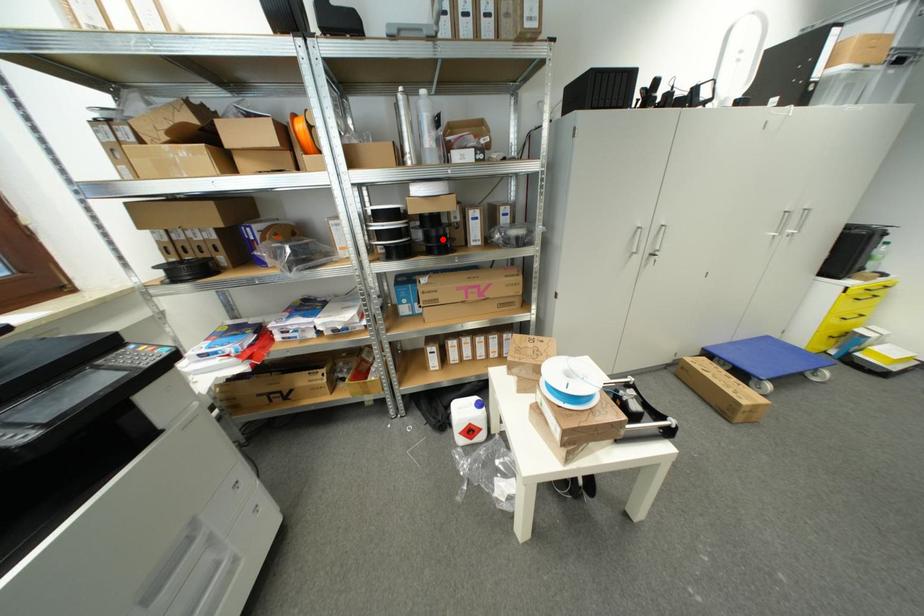
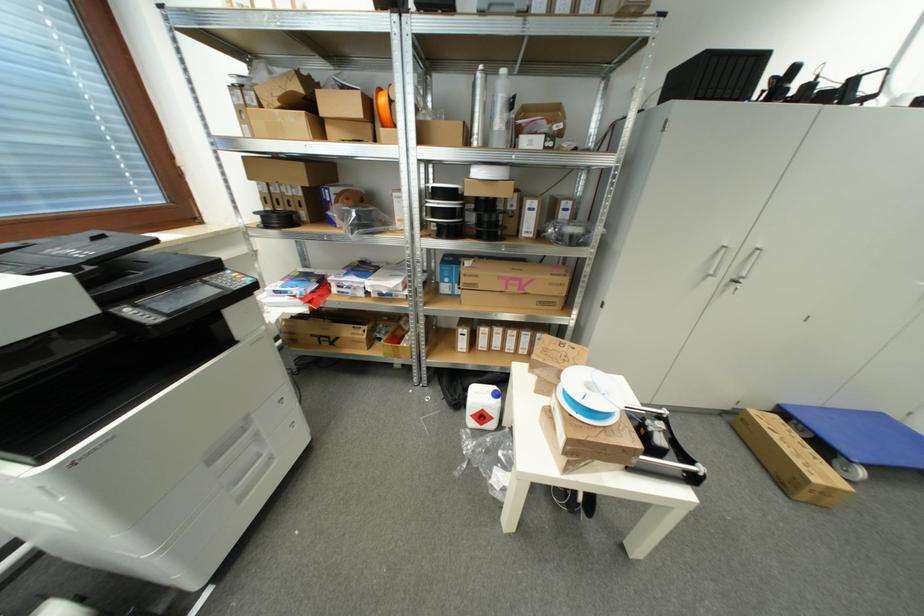
In the second image, find the point that corresponds to the highlighted location in the first image.

(493, 225)